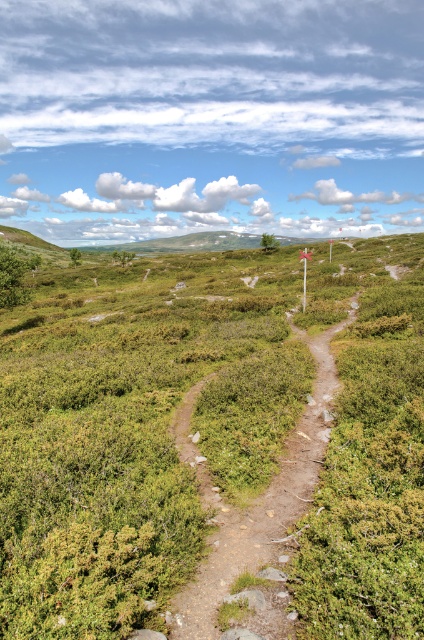
Can you confirm if green leafy shrubs at center is positioned above dirt path at center?

Yes.

Does green leafy shrubs at center have a larger size compared to dirt path at center?

Yes, green leafy shrubs at center is bigger than dirt path at center.

You are a GUI agent. You are given a task and a screenshot of the screen. Output one action in this format:
    pyautogui.click(x=<x>, y=<y>)
    Task: Click on the green leafy shrubs at center
    
    Given the screenshot: What is the action you would take?
    pyautogui.click(x=133, y=433)